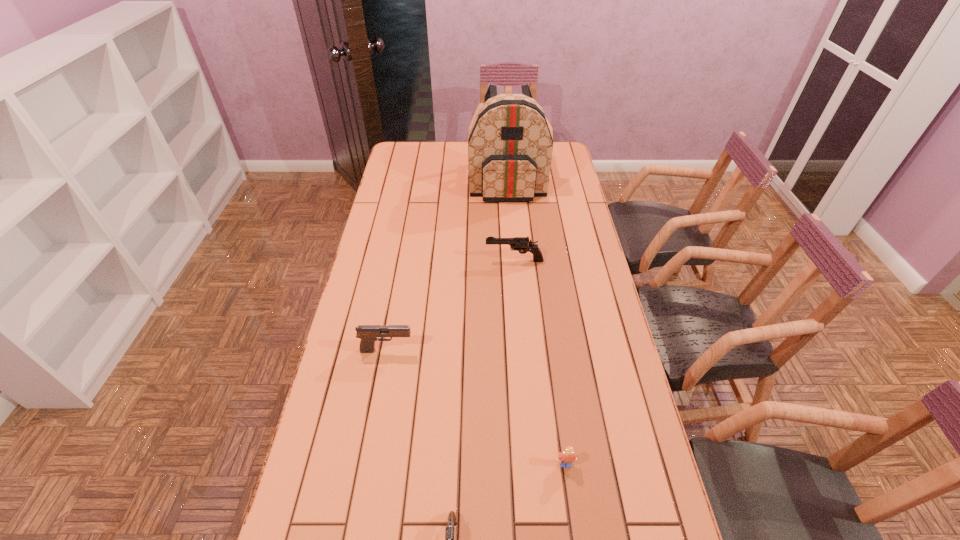
Identify the location of free space located 0.180m at the end of the barrel of the fourth nearest object. (436, 260).

Where is `vacant space positioned at the end of the barrel of the fourth nearest object`? vacant space positioned at the end of the barrel of the fourth nearest object is located at coordinates (381, 260).

Where is `free space located at the end of the barrel of the fourth nearest object`? The image size is (960, 540). free space located at the end of the barrel of the fourth nearest object is located at coordinates (403, 260).

The height and width of the screenshot is (540, 960). Identify the location of free region located on the front-facing side of the fourth tallest object. (573, 522).

Identify the location of object located at the far edge. (510, 146).

Image resolution: width=960 pixels, height=540 pixels. Find the location of `object at the left edge`. object at the left edge is located at coordinates (367, 333).

In order to click on object located at the right edge in this screenshot , I will do `click(510, 146)`.

Where is `object present at the far right corner`? object present at the far right corner is located at coordinates (510, 146).

The height and width of the screenshot is (540, 960). I want to click on vacant space at the left edge, so click(x=374, y=290).

The height and width of the screenshot is (540, 960). What are the coordinates of `free space at the right edge of the desktop` in the screenshot? It's located at (573, 256).